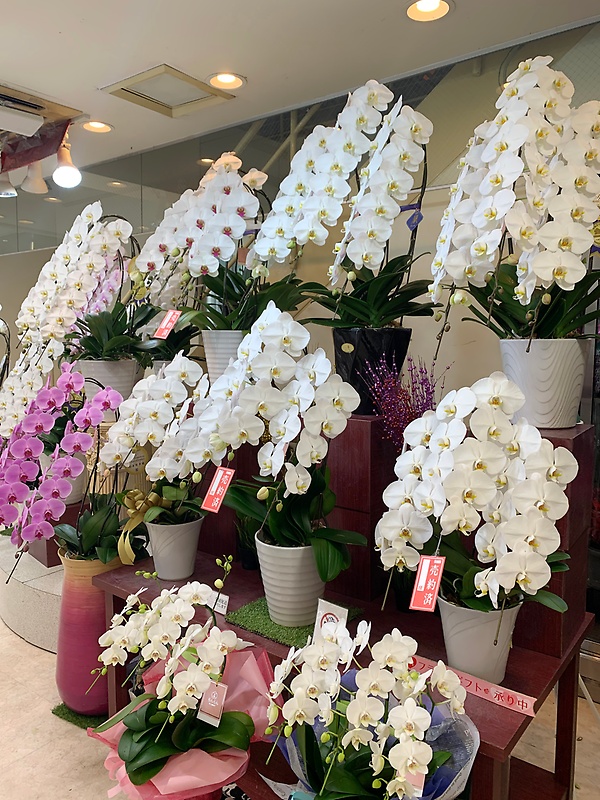
The width and height of the screenshot is (600, 800). I want to click on lights, so click(x=225, y=74), click(x=427, y=8), click(x=93, y=122), click(x=69, y=174).